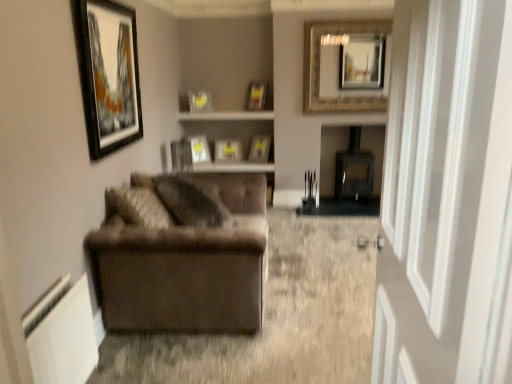
The image size is (512, 384). In order to click on matte glass picture frame at upper center, the 5th picture frame positioned from the right in this screenshot , I will do click(x=200, y=101).

Describe the element at coordinates (259, 149) in the screenshot. The width and height of the screenshot is (512, 384). I see `matte wooden picture frame at center, arranged as the seventh picture frame when viewed from the left` at that location.

You are a GUI agent. You are given a task and a screenshot of the screen. Output one action in this format:
    pyautogui.click(x=<x>, y=<y>)
    Task: Click on the matte glass picture frame at upper center, the 4th picture frame positioned from the front
    This screenshot has width=512, height=384.
    Given the screenshot: What is the action you would take?
    256,96

Locate an element on the screen. The image size is (512, 384). brown fabric armchair at left is located at coordinates (275, 318).

Which of these two, matte black wood table at center or matte wooden picture frame at center, placed as the 2th picture frame when sorted from right to left, is smaller?

matte wooden picture frame at center, placed as the 2th picture frame when sorted from right to left, is smaller.

What's the angular difference between matte black wood table at center and matte wooden picture frame at center, acting as the sixth picture frame starting from the front,'s facing directions?

The angular difference between matte black wood table at center and matte wooden picture frame at center, acting as the sixth picture frame starting from the front, is 39.1 degrees.

Is matte black wood table at center positioned with its back to matte wooden picture frame at center, placed as the 2th picture frame when sorted from right to left?

matte black wood table at center is not turned away from matte wooden picture frame at center, placed as the 2th picture frame when sorted from right to left.

Could you tell me if velvet brown couch at left is facing matte glass picture frame at upper center, the 6th picture frame in the left-to-right sequence?

No, velvet brown couch at left does not turn towards matte glass picture frame at upper center, the 6th picture frame in the left-to-right sequence.

Is point (158, 310) behind point (255, 97)?

No.

At what (x,y) coordinates should I click in order to perform the action: click on the 7th picture frame above the velvet brown couch at left (from the image's perspective). Please return your answer as a coordinate pair (x, y). This screenshot has width=512, height=384. Looking at the image, I should click on (256, 96).

Is metallic silver picture frame at center, the seventh picture frame in the back-to-front sequence, situated inside matte black wood table at center or outside?

metallic silver picture frame at center, the seventh picture frame in the back-to-front sequence, is located beyond the bounds of matte black wood table at center.

Is metallic silver picture frame at center, the 2th picture frame from the left, closer to camera compared to matte black wood table at center?

That is True.

Is metallic silver picture frame at center, the seventh picture frame in the back-to-front sequence, facing away from matte black wood table at center?

That's not correct — metallic silver picture frame at center, the seventh picture frame in the back-to-front sequence, is not looking away from matte black wood table at center.

From the image's perspective, is metallic silver picture frame at center, the seventh picture frame in the back-to-front sequence, below matte black wood table at center?

No, from the image's perspective, metallic silver picture frame at center, the seventh picture frame in the back-to-front sequence, is not below matte black wood table at center.

Is velvet brown couch at left next to black glossy picture frame at upper left, placed as the 8th picture frame when sorted from back to front?

velvet brown couch at left and black glossy picture frame at upper left, placed as the 8th picture frame when sorted from back to front, are not in contact.

Between point (222, 181) and point (111, 86), which one is positioned behind?

The point (222, 181) is farther.

In the scene shown: From the image's perspective, which is above, velvet brown couch at left or black glossy picture frame at upper left, which is the 8th picture frame in right-to-left order?

black glossy picture frame at upper left, which is the 8th picture frame in right-to-left order, appears higher in the image.

Does velvet brown couch at left have a greater height compared to black glossy picture frame at upper left, marked as the 1th picture frame in a front-to-back arrangement?

In fact, velvet brown couch at left may be shorter than black glossy picture frame at upper left, marked as the 1th picture frame in a front-to-back arrangement.

Considering the sizes of objects matte black picture frame at center, which is counted as the 3th picture frame, starting from the left, and black glossy picture frame at upper left, positioned as the first picture frame in left-to-right order, in the image provided, who is taller, matte black picture frame at center, which is counted as the 3th picture frame, starting from the left, or black glossy picture frame at upper left, positioned as the first picture frame in left-to-right order,?

Standing taller between the two is black glossy picture frame at upper left, positioned as the first picture frame in left-to-right order.

At what (x,y) coordinates should I click in order to perform the action: click on the 1st picture frame positioned above the matte black picture frame at center, placed as the sixth picture frame when sorted from right to left (from the image's perspective). Please return your answer as a coordinate pair (x, y). The width and height of the screenshot is (512, 384). Looking at the image, I should click on (108, 74).

From the image's perspective, is matte black picture frame at center, the 7th picture frame viewed from the front, under black glossy picture frame at upper left, placed as the 8th picture frame when sorted from back to front?

Yes, from the image's perspective, matte black picture frame at center, the 7th picture frame viewed from the front, is beneath black glossy picture frame at upper left, placed as the 8th picture frame when sorted from back to front.

Is black glossy picture frame at upper left, positioned as the first picture frame in left-to-right order, surrounded by matte black picture frame at center, placed as the sixth picture frame when sorted from right to left?

Definitely not — black glossy picture frame at upper left, positioned as the first picture frame in left-to-right order, is not inside matte black picture frame at center, placed as the sixth picture frame when sorted from right to left.

Does black glossy picture frame at upper left, which is the 8th picture frame in right-to-left order, have a greater height compared to matte glass picture frame at upper center, the 4th picture frame positioned from the front?

Yes.

Which object is further away from the camera taking this photo, black glossy picture frame at upper left, positioned as the first picture frame in left-to-right order, or matte glass picture frame at upper center, the third picture frame in the right-to-left sequence?

matte glass picture frame at upper center, the third picture frame in the right-to-left sequence, is further from the camera.

Is point (185, 113) less distant than point (201, 140)?

Yes, point (185, 113) is in front of point (201, 140).

Considering the relative sizes of wooden shelf at center and matte black picture frame at center, the 7th picture frame viewed from the front, in the image provided, is wooden shelf at center bigger than matte black picture frame at center, the 7th picture frame viewed from the front,?

Yes, wooden shelf at center is bigger than matte black picture frame at center, the 7th picture frame viewed from the front.

Is wooden shelf at center not within matte black picture frame at center, the second picture frame positioned from the back?

Yes, wooden shelf at center is located beyond the bounds of matte black picture frame at center, the second picture frame positioned from the back.

I want to click on shelf that is above the matte black picture frame at center, which is counted as the 3th picture frame, starting from the left (from a real-world perspective), so click(x=227, y=116).

From the image's perspective, starting from the matte black wood table at center, which picture frame is the 2nd one above? Please provide its 2D coordinates.

[(259, 149)]

From a real-world perspective, count 6th picture frames upward from the velvet brown couch at left and point to it. Please provide its 2D coordinates.

[(256, 96)]

Estimate the real-world distances between objects in this image. Which object is closer to matte silver picture frame at center, acting as the fourth picture frame starting from the right, gold-framed mirror at upper center, the third picture frame when ordered from front to back, or matte black wood table at center?

Based on the image, matte black wood table at center appears to be nearer to matte silver picture frame at center, acting as the fourth picture frame starting from the right.

Estimate the real-world distances between objects in this image. Which object is further from matte black picture frame at center, placed as the sixth picture frame when sorted from right to left, matte glass picture frame at upper center, the third picture frame in the right-to-left sequence, or black glossy picture frame at upper left, which is the 8th picture frame in right-to-left order?

The object further to matte black picture frame at center, placed as the sixth picture frame when sorted from right to left, is black glossy picture frame at upper left, which is the 8th picture frame in right-to-left order.

Looking at the image, which one is located further to brown fabric armchair at left, wooden shelf at center or matte glass picture frame at upper center, which appears as the fourth picture frame when viewed from the back?

The object further to brown fabric armchair at left is matte glass picture frame at upper center, which appears as the fourth picture frame when viewed from the back.

Which object lies nearer to the anchor point metallic silver picture frame at center, the 2th picture frame from the left, matte wooden picture frame at center, arranged as the seventh picture frame when viewed from the left, or matte black wood table at center?

matte wooden picture frame at center, arranged as the seventh picture frame when viewed from the left, lies closer to metallic silver picture frame at center, the 2th picture frame from the left, than the other object.

From the image, which object appears to be farther from brown fabric armchair at left, matte black wood table at center or gold-framed mirror at upper center, which is counted as the eighth picture frame, starting from the left?

Based on the image, gold-framed mirror at upper center, which is counted as the eighth picture frame, starting from the left, appears to be further to brown fabric armchair at left.

Based on the photo, when comparing their distances from black glossy picture frame at upper left, marked as the 1th picture frame in a front-to-back arrangement, does matte silver picture frame at center, the 5th picture frame when ordered from left to right, or wooden shelf at center seem further?

Based on the image, matte silver picture frame at center, the 5th picture frame when ordered from left to right, appears to be further to black glossy picture frame at upper left, marked as the 1th picture frame in a front-to-back arrangement.

Based on their spatial positions, is matte wooden picture frame at center, placed as the 2th picture frame when sorted from right to left, or matte silver picture frame at center, the 1th picture frame when ordered from back to front, further from matte black wood table at center?

matte silver picture frame at center, the 1th picture frame when ordered from back to front, lies further to matte black wood table at center than the other object.

Based on their spatial positions, is wooden shelf at center or matte wooden picture frame at center, arranged as the seventh picture frame when viewed from the left, closer to transparent glass door at right?

wooden shelf at center is positioned closer to the anchor transparent glass door at right.

Identify the location of shelf between metallic silver picture frame at center, which is the 7th picture frame in right-to-left order, and matte silver picture frame at center, the 1th picture frame when ordered from back to front, in the front-back direction. The height and width of the screenshot is (384, 512). (227, 116).

The width and height of the screenshot is (512, 384). In order to click on picture frame located between matte wooden picture frame at center, placed as the 2th picture frame when sorted from right to left, and matte black wood table at center in the left-right direction in this screenshot , I will do `click(347, 66)`.

This screenshot has width=512, height=384. I want to click on studio couch between transparent glass door at right and gold-framed mirror at upper center, acting as the 1th picture frame starting from the right, in the front-back direction, so click(186, 266).

Locate an element on the screen. shelf situated between matte black picture frame at center, placed as the sixth picture frame when sorted from right to left, and gold-framed mirror at upper center, the third picture frame when ordered from front to back, from left to right is located at coordinates (227, 116).